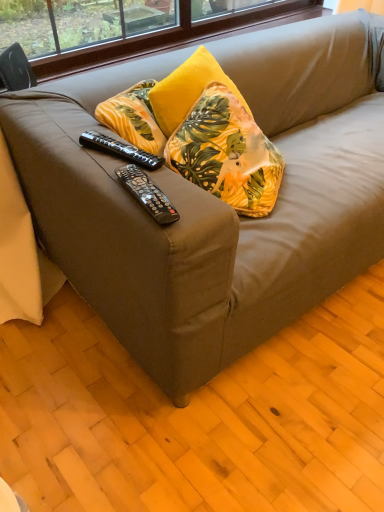
Measure the distance between black plastic remote control at center, the 1th remote control positioned from the front, and camera.

The distance of black plastic remote control at center, the 1th remote control positioned from the front, from camera is 30.47 inches.

In order to face yellow fabric pillow at center, should I rotate leftwards or rightwards?

To align with it, rotate right about 6.070°.

Identify the location of black plastic remote control at center, positioned as the 2th remote control in bottom-to-top order. This screenshot has width=384, height=512. (120, 150).

Between black plastic remote control at center, the 1th remote control positioned from the back, and black plastic remote control at center, which is the 2th remote control from top to bottom, which one is positioned in front?

Positioned in front is black plastic remote control at center, which is the 2th remote control from top to bottom.

From a real-world perspective, who is located lower, black plastic remote control at center, which appears as the second remote control when viewed from the front, or black plastic remote control at center, which is the 2th remote control from top to bottom?

black plastic remote control at center, which appears as the second remote control when viewed from the front.

Does black plastic remote control at center, the 1th remote control positioned from the back, have a larger size compared to black plastic remote control at center, positioned as the second remote control in back-to-front order?

Yes.

Can you confirm if black plastic remote control at center, placed as the first remote control when sorted from top to bottom, is thinner than black plastic remote control at center, the 1th remote control positioned from the front?

→ Incorrect, the width of black plastic remote control at center, placed as the first remote control when sorted from top to bottom, is not less than that of black plastic remote control at center, the 1th remote control positioned from the front.

Is black plastic remote control at center, the 1th remote control positioned from the front, further to camera compared to yellow fabric pillow at center?

No, it is not.

Is yellow fabric pillow at center located within black plastic remote control at center, which is the 2th remote control from top to bottom?

Actually, yellow fabric pillow at center is outside black plastic remote control at center, which is the 2th remote control from top to bottom.

Considering the positions of objects black plastic remote control at center, positioned as the second remote control in back-to-front order, and yellow fabric pillow at center in the image provided, who is more to the right, black plastic remote control at center, positioned as the second remote control in back-to-front order, or yellow fabric pillow at center?

Positioned to the right is yellow fabric pillow at center.

Considering the relative sizes of black plastic remote control at center, marked as the first remote control in a bottom-to-top arrangement, and yellow fabric pillow at center in the image provided, is black plastic remote control at center, marked as the first remote control in a bottom-to-top arrangement, smaller than yellow fabric pillow at center?

Yes, black plastic remote control at center, marked as the first remote control in a bottom-to-top arrangement, is smaller than yellow fabric pillow at center.

From a real-world perspective, is black plastic remote control at center, which is the 2th remote control from top to bottom, physically below black plastic remote control at center, positioned as the 2th remote control in bottom-to-top order?

Incorrect, from a real-world perspective, black plastic remote control at center, which is the 2th remote control from top to bottom, is higher than black plastic remote control at center, positioned as the 2th remote control in bottom-to-top order.

Could you tell me if black plastic remote control at center, which is the 2th remote control from top to bottom, is turned towards black plastic remote control at center, placed as the first remote control when sorted from top to bottom?

No, black plastic remote control at center, which is the 2th remote control from top to bottom, is not facing towards black plastic remote control at center, placed as the first remote control when sorted from top to bottom.

Is black plastic remote control at center, which is the 2th remote control from top to bottom, not inside black plastic remote control at center, the 1th remote control positioned from the back?

That's correct, black plastic remote control at center, which is the 2th remote control from top to bottom, is outside of black plastic remote control at center, the 1th remote control positioned from the back.

Does point (155, 219) come behind point (106, 143)?

No, it is not.

From a real-world perspective, between yellow fabric pillow at center and black plastic remote control at center, positioned as the 2th remote control in bottom-to-top order, who is vertically higher?

From a 3D spatial view, black plastic remote control at center, positioned as the 2th remote control in bottom-to-top order, is above.

In the scene shown: Is yellow fabric pillow at center not near black plastic remote control at center, which appears as the second remote control when viewed from the front?

That's not correct — yellow fabric pillow at center is a little close to black plastic remote control at center, which appears as the second remote control when viewed from the front.

Between yellow fabric pillow at center and black plastic remote control at center, which appears as the second remote control when viewed from the front, which one has larger size?

yellow fabric pillow at center.

From the image's perspective, which one is positioned higher, yellow fabric pillow at center or black plastic remote control at center, which appears as the second remote control when viewed from the front?

yellow fabric pillow at center.

Can you tell me how much yellow fabric pillow at center and black plastic remote control at center, positioned as the second remote control in back-to-front order, differ in facing direction?

45.6 degrees separate the facing orientations of yellow fabric pillow at center and black plastic remote control at center, positioned as the second remote control in back-to-front order.

From the image's perspective, is yellow fabric pillow at center positioned above or below black plastic remote control at center, which is the 2th remote control from top to bottom?

yellow fabric pillow at center is above black plastic remote control at center, which is the 2th remote control from top to bottom.

From a real-world perspective, is yellow fabric pillow at center located higher than black plastic remote control at center, which is the 2th remote control from top to bottom?

Actually, yellow fabric pillow at center is physically below black plastic remote control at center, which is the 2th remote control from top to bottom, in the real world.

Between yellow fabric pillow at center and black plastic remote control at center, the 1th remote control positioned from the front, which one appears on the right side from the viewer's perspective?

Positioned to the right is yellow fabric pillow at center.

Which is in front, point (144, 164) or point (224, 190)?

The point (144, 164) is closer to the camera.

Which object is closer to the camera, black plastic remote control at center, which appears as the second remote control when viewed from the front, or yellow fabric pillow at center?

black plastic remote control at center, which appears as the second remote control when viewed from the front, is more forward.

Between black plastic remote control at center, the 1th remote control positioned from the back, and yellow fabric pillow at center, which one has larger width?

yellow fabric pillow at center.

Where is `remote control to the left of black plastic remote control at center, positioned as the second remote control in back-to-front order`? remote control to the left of black plastic remote control at center, positioned as the second remote control in back-to-front order is located at coordinates (120, 150).

Find the location of a particular element. This screenshot has height=512, width=384. pillow that appears on the right of black plastic remote control at center, which is the 2th remote control from top to bottom is located at coordinates (226, 153).

From the picture: When comparing their distances from yellow fabric pillow at center, does black plastic remote control at center, which is the 2th remote control from top to bottom, or black plastic remote control at center, which appears as the second remote control when viewed from the front, seem closer?

Based on the image, black plastic remote control at center, which appears as the second remote control when viewed from the front, appears to be nearer to yellow fabric pillow at center.

Which object lies further to the anchor point black plastic remote control at center, positioned as the second remote control in back-to-front order, yellow fabric pillow at center or black plastic remote control at center, the 1th remote control positioned from the back?

yellow fabric pillow at center lies further to black plastic remote control at center, positioned as the second remote control in back-to-front order, than the other object.

Considering their positions, is black plastic remote control at center, which appears as the second remote control when viewed from the front, positioned further to yellow fabric pillow at center than black plastic remote control at center, which is the 2th remote control from top to bottom?

Among the two, black plastic remote control at center, which is the 2th remote control from top to bottom, is located further to yellow fabric pillow at center.

Based on their spatial positions, is black plastic remote control at center, placed as the first remote control when sorted from top to bottom, or yellow fabric pillow at center closer to black plastic remote control at center, the 1th remote control positioned from the front?

black plastic remote control at center, placed as the first remote control when sorted from top to bottom, lies closer to black plastic remote control at center, the 1th remote control positioned from the front, than the other object.

Which object lies nearer to the anchor point black plastic remote control at center, placed as the first remote control when sorted from top to bottom, black plastic remote control at center, positioned as the second remote control in back-to-front order, or yellow fabric pillow at center?

black plastic remote control at center, positioned as the second remote control in back-to-front order, is closer to black plastic remote control at center, placed as the first remote control when sorted from top to bottom.

Considering their positions, is yellow fabric pillow at center positioned further to black plastic remote control at center, which appears as the second remote control when viewed from the front, than black plastic remote control at center, marked as the first remote control in a bottom-to-top arrangement?

yellow fabric pillow at center is positioned further to the anchor black plastic remote control at center, which appears as the second remote control when viewed from the front.

This screenshot has width=384, height=512. In order to click on remote control located between black plastic remote control at center, positioned as the 2th remote control in bottom-to-top order, and yellow fabric pillow at center in the left-right direction in this screenshot , I will do `click(147, 194)`.